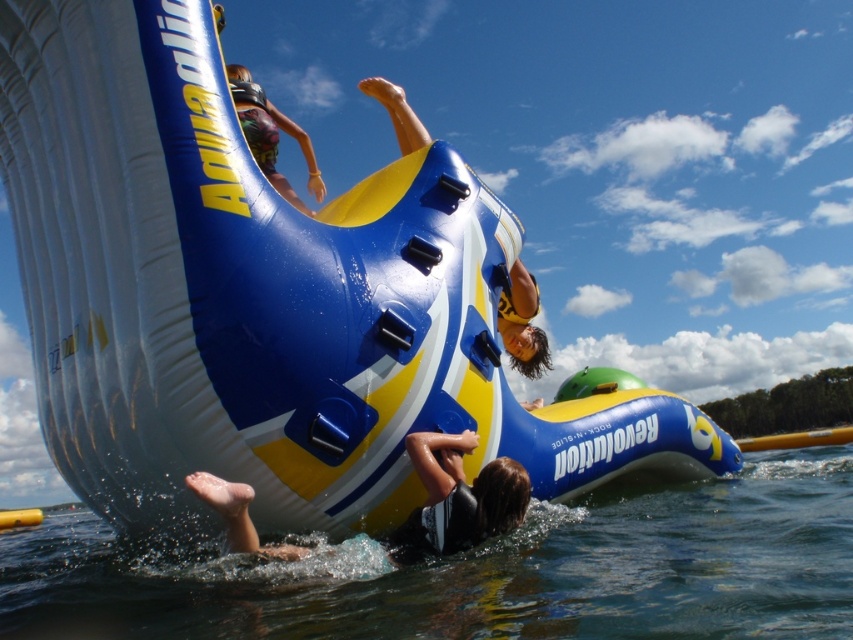
Is point (204, 480) positioned behind point (524, 356)?

No.

The width and height of the screenshot is (853, 640). Describe the element at coordinates (457, 499) in the screenshot. I see `dark blue wetsuit at lower center` at that location.

The width and height of the screenshot is (853, 640). Identify the location of dark blue wetsuit at lower center. (457, 499).

Is point (9, 605) positioned before point (283, 189)?

Yes, point (9, 605) is in front of point (283, 189).

Who is positioned more to the left, clear water at lower center or multicolored fabric shorts at upper center?

multicolored fabric shorts at upper center

Between point (129, 620) and point (277, 109), which one is positioned behind?

Positioned behind is point (277, 109).

Where is `clear water at lower center`? Image resolution: width=853 pixels, height=640 pixels. clear water at lower center is located at coordinates (483, 572).

Between clear water at lower center and dark blue wetsuit at lower center, which one has more height?

clear water at lower center is taller.

Which is behind, point (838, 481) or point (419, 548)?

Positioned behind is point (838, 481).

The width and height of the screenshot is (853, 640). In order to click on clear water at lower center in this screenshot , I will do `click(483, 572)`.